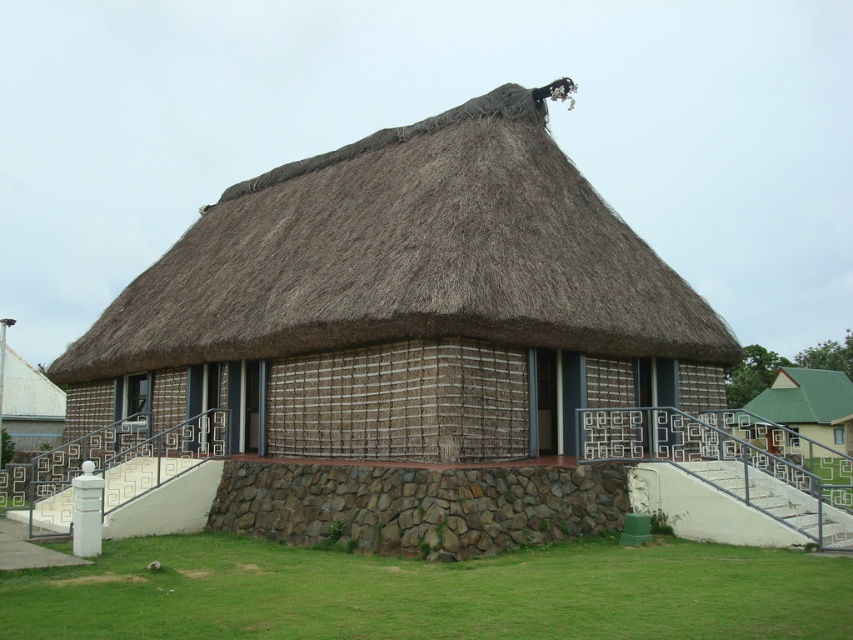
Question: Is brown thatch at center closer to the viewer compared to brown rough stone wall at center?

Choices:
 (A) no
 (B) yes

Answer: (A)

Question: Does brown thatch at center appear over brown rough stone wall at center?

Choices:
 (A) no
 (B) yes

Answer: (B)

Question: Which is nearer to the brown thatch at center?

Choices:
 (A) green grass at lower center
 (B) brown rough stone wall at center

Answer: (B)

Question: Which point appears closest to the camera in this image?

Choices:
 (A) (375, 336)
 (B) (846, 557)

Answer: (B)

Question: Which point is closer to the camera?

Choices:
 (A) (108, 333)
 (B) (227, 497)

Answer: (B)

Question: Observing the image, what is the correct spatial positioning of green grass at lower center in reference to brown rough stone wall at center?

Choices:
 (A) above
 (B) below

Answer: (B)